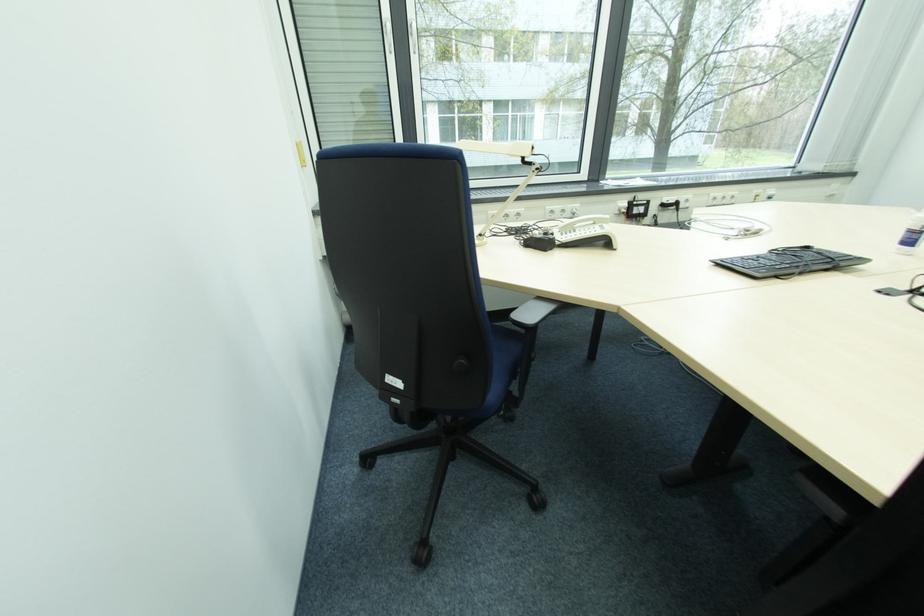
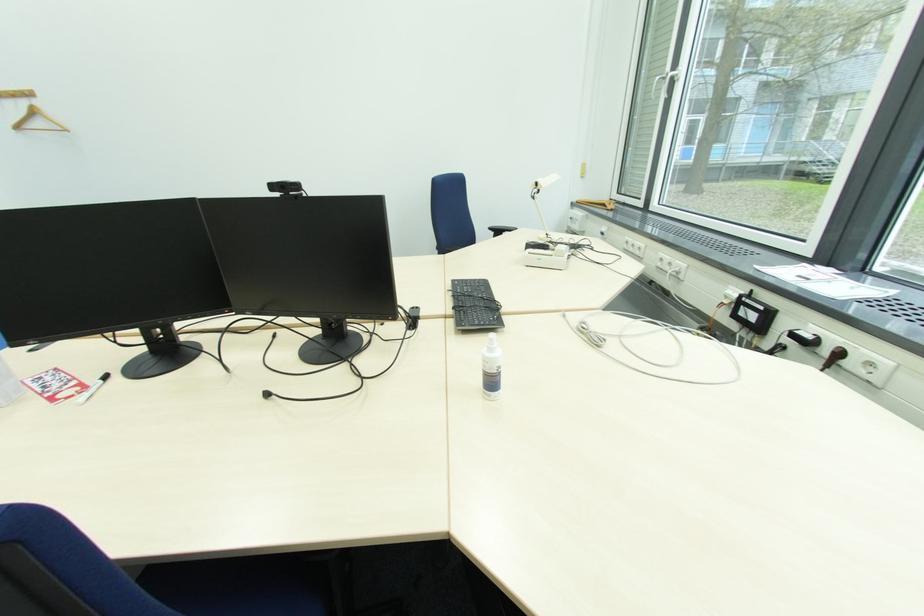
Locate, in the second image, the point that corresponds to (x=767, y=273) in the first image.

(459, 285)